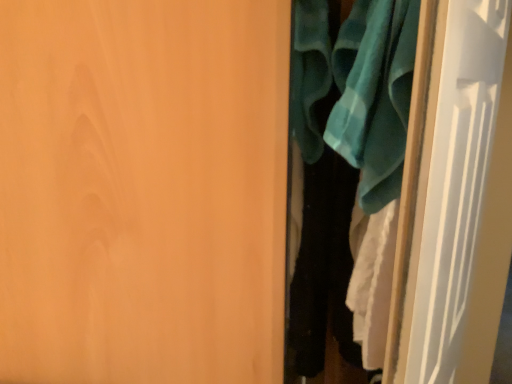
Question: Is white glossy door at right, the second door viewed from the left, to the right of teal fabric bath towel at upper right from the viewer's perspective?

Choices:
 (A) no
 (B) yes

Answer: (B)

Question: Considering the relative sizes of white glossy door at right, which ranks as the 1th door in right-to-left order, and teal fabric bath towel at upper right in the image provided, is white glossy door at right, which ranks as the 1th door in right-to-left order, bigger than teal fabric bath towel at upper right?

Choices:
 (A) no
 (B) yes

Answer: (B)

Question: Can you confirm if white glossy door at right, which ranks as the 1th door in right-to-left order, is shorter than teal fabric bath towel at upper right?

Choices:
 (A) yes
 (B) no

Answer: (B)

Question: Is white glossy door at right, which ranks as the 1th door in right-to-left order, taller than teal fabric bath towel at upper right?

Choices:
 (A) no
 (B) yes

Answer: (B)

Question: Is white glossy door at right, the second door viewed from the left, not close to teal fabric bath towel at upper right?

Choices:
 (A) yes
 (B) no

Answer: (B)

Question: From a real-world perspective, is teal fabric clothes at right above or below matte wood door at center, arranged as the first door when viewed from the left?

Choices:
 (A) above
 (B) below

Answer: (A)

Question: In terms of height, does teal fabric clothes at right look taller or shorter compared to matte wood door at center, marked as the 2th door in a right-to-left arrangement?

Choices:
 (A) short
 (B) tall

Answer: (A)

Question: Considering the positions of teal fabric clothes at right and matte wood door at center, marked as the 2th door in a right-to-left arrangement, in the image, is teal fabric clothes at right bigger or smaller than matte wood door at center, marked as the 2th door in a right-to-left arrangement,?

Choices:
 (A) big
 (B) small

Answer: (B)

Question: Looking at their shapes, would you say teal fabric clothes at right is wider or thinner than matte wood door at center, marked as the 2th door in a right-to-left arrangement?

Choices:
 (A) thin
 (B) wide

Answer: (A)

Question: From a real-world perspective, relative to matte wood door at center, arranged as the first door when viewed from the left, is white glossy door at right, the second door viewed from the left, vertically above or below?

Choices:
 (A) below
 (B) above

Answer: (B)

Question: Considering the positions of white glossy door at right, which ranks as the 1th door in right-to-left order, and matte wood door at center, arranged as the first door when viewed from the left, in the image, is white glossy door at right, which ranks as the 1th door in right-to-left order, taller or shorter than matte wood door at center, arranged as the first door when viewed from the left,?

Choices:
 (A) tall
 (B) short

Answer: (B)

Question: Based on their sizes in the image, would you say white glossy door at right, which ranks as the 1th door in right-to-left order, is bigger or smaller than matte wood door at center, marked as the 2th door in a right-to-left arrangement?

Choices:
 (A) small
 (B) big

Answer: (A)

Question: Considering the relative positions of white glossy door at right, which ranks as the 1th door in right-to-left order, and matte wood door at center, arranged as the first door when viewed from the left, in the image provided, is white glossy door at right, which ranks as the 1th door in right-to-left order, to the left or to the right of matte wood door at center, arranged as the first door when viewed from the left,?

Choices:
 (A) left
 (B) right

Answer: (B)

Question: In terms of size, does teal fabric bath towel at upper right appear bigger or smaller than teal fabric clothes at right?

Choices:
 (A) big
 (B) small

Answer: (B)

Question: Considering the positions of teal fabric bath towel at upper right and teal fabric clothes at right in the image, is teal fabric bath towel at upper right taller or shorter than teal fabric clothes at right?

Choices:
 (A) short
 (B) tall

Answer: (A)